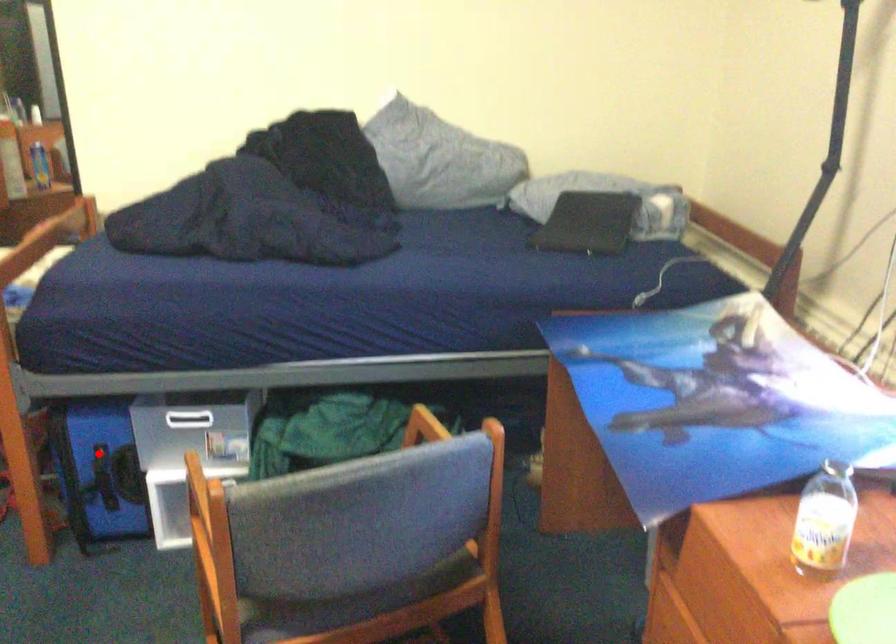
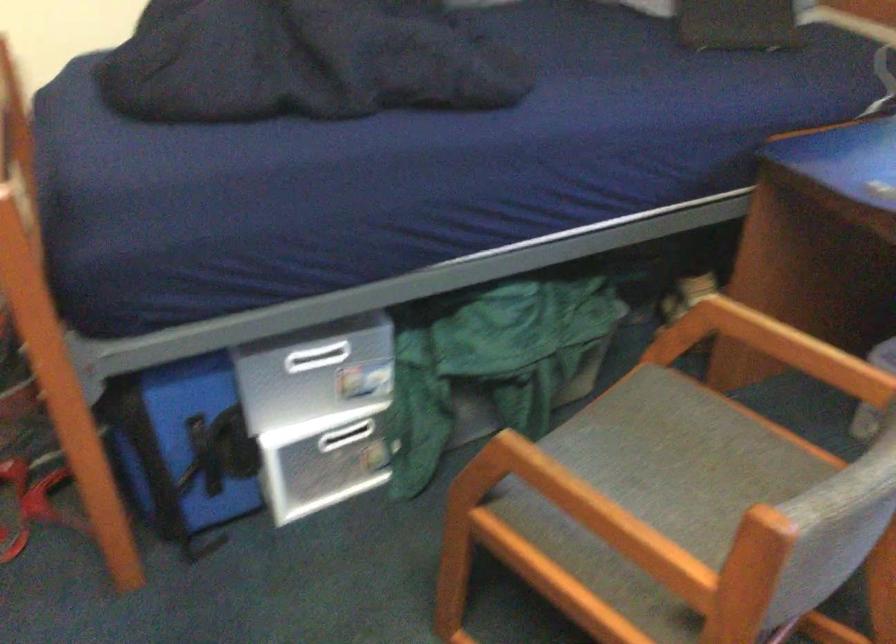
Find the pixel in the second image that matches the highlighted location in the first image.

(200, 428)